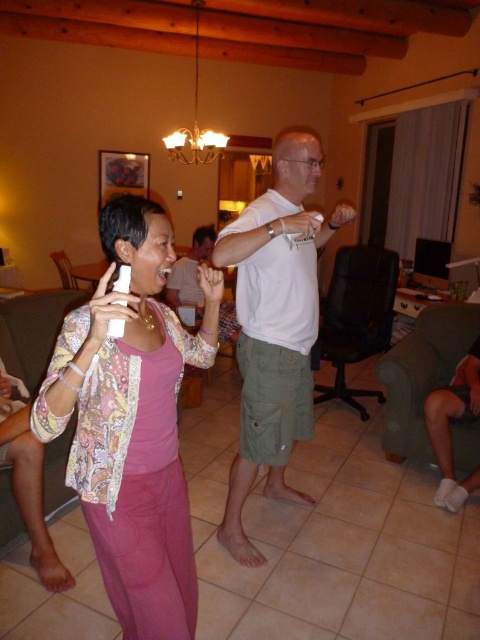
Question: Can you confirm if matte pink pants at center is positioned to the left of white cotton shirt at center?

Choices:
 (A) no
 (B) yes

Answer: (B)

Question: Among these objects, which one is nearest to the camera?

Choices:
 (A) matte pink pants at center
 (B) white cotton shirt at center

Answer: (A)

Question: Is matte pink pants at center wider than white cotton shirt at center?

Choices:
 (A) no
 (B) yes

Answer: (A)

Question: Is matte pink pants at center thinner than white cotton shirt at center?

Choices:
 (A) no
 (B) yes

Answer: (B)

Question: Which object is farther from the camera taking this photo?

Choices:
 (A) white cotton shirt at center
 (B) matte pink pants at center

Answer: (A)